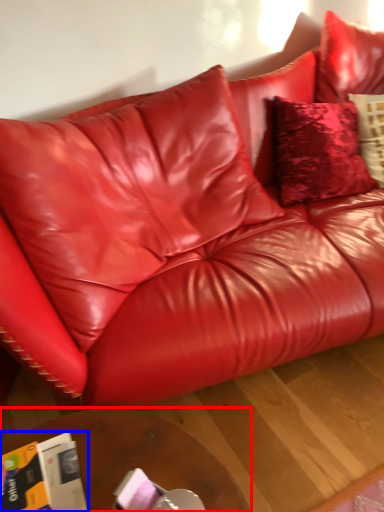
Question: Which point is closer to the camera, table (highlighted by a red box) or magazine (highlighted by a blue box)?

Choices:
 (A) table
 (B) magazine

Answer: (B)